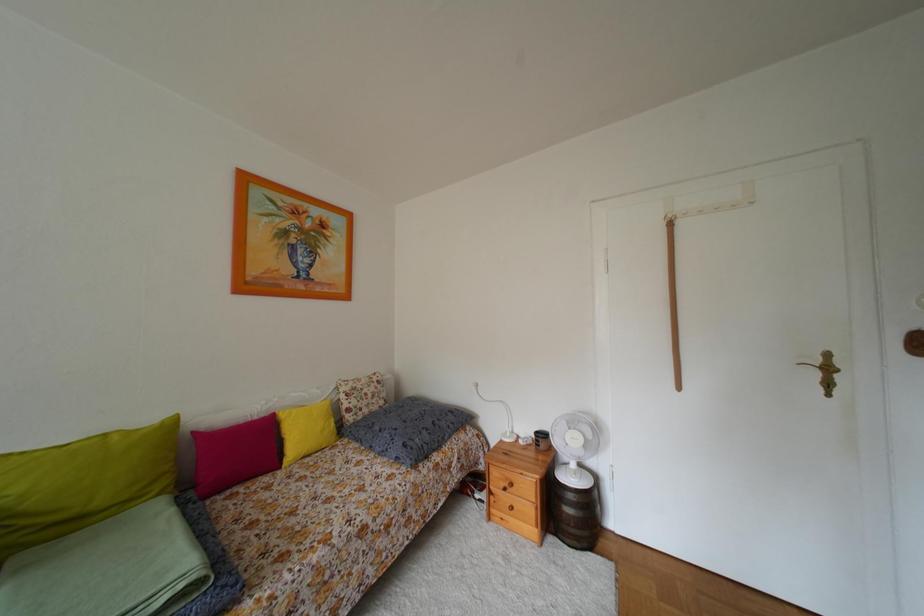
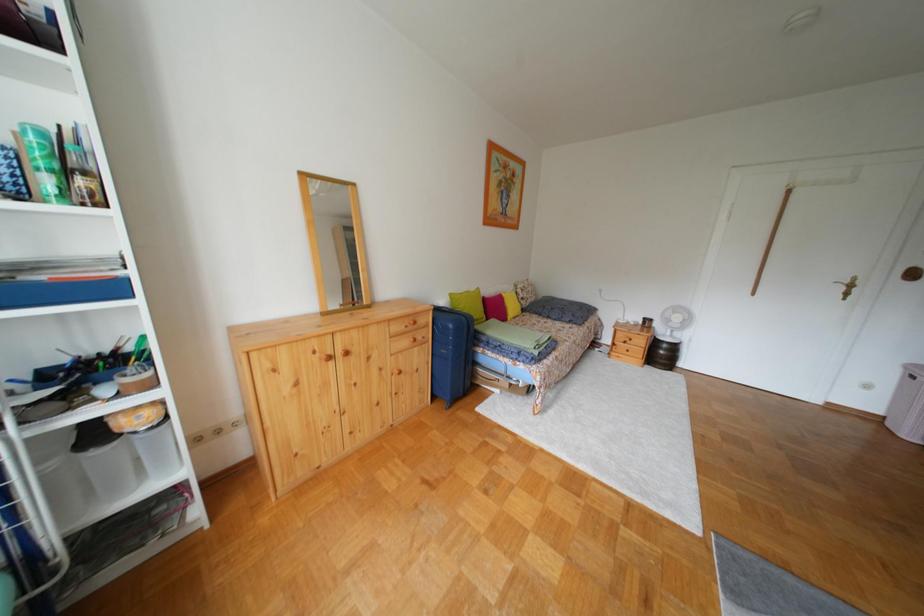
In a continuous first-person perspective shot, in which direction is the camera moving?

The cameraman moved toward left, backward.